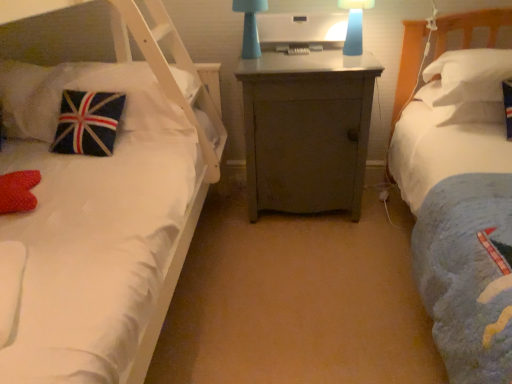
Question: From a real-world perspective, is white soft pillow at right, positioned as the first pillow in right-to-left order, physically above blue matte lampshade at upper center, which is counted as the first bedside lamp, starting from the right?

Choices:
 (A) yes
 (B) no

Answer: (B)

Question: Are white soft pillow at right, positioned as the first pillow in right-to-left order, and blue matte lampshade at upper center, which is counted as the first bedside lamp, starting from the right, making contact?

Choices:
 (A) no
 (B) yes

Answer: (A)

Question: Considering the relative sizes of white soft pillow at right, positioned as the first pillow in right-to-left order, and blue matte lampshade at upper center, which ranks as the second bedside lamp in left-to-right order, in the image provided, is white soft pillow at right, positioned as the first pillow in right-to-left order, thinner than blue matte lampshade at upper center, which ranks as the second bedside lamp in left-to-right order,?

Choices:
 (A) yes
 (B) no

Answer: (B)

Question: Is white soft pillow at right, the third pillow when ordered from left to right, facing towards blue matte lampshade at upper center, which ranks as the second bedside lamp in left-to-right order?

Choices:
 (A) no
 (B) yes

Answer: (A)

Question: Can you confirm if white soft pillow at right, positioned as the first pillow in right-to-left order, is smaller than blue matte lampshade at upper center, which is counted as the first bedside lamp, starting from the right?

Choices:
 (A) yes
 (B) no

Answer: (B)

Question: From a real-world perspective, is white soft pillow at right, which is counted as the second pillow, starting from the right, physically located above or below blue matte lampshade at upper center, which is counted as the first bedside lamp, starting from the right?

Choices:
 (A) above
 (B) below

Answer: (B)

Question: Is white soft pillow at right, placed as the second pillow when sorted from left to right, situated inside blue matte lampshade at upper center, which is counted as the first bedside lamp, starting from the right, or outside?

Choices:
 (A) outside
 (B) inside

Answer: (A)

Question: From the image's perspective, is white soft pillow at right, placed as the second pillow when sorted from left to right, positioned above or below blue matte lampshade at upper center, which ranks as the second bedside lamp in left-to-right order?

Choices:
 (A) above
 (B) below

Answer: (B)

Question: Based on their sizes in the image, would you say white soft pillow at right, placed as the second pillow when sorted from left to right, is bigger or smaller than blue matte lampshade at upper center, which is counted as the first bedside lamp, starting from the right?

Choices:
 (A) big
 (B) small

Answer: (A)

Question: Does point (354, 11) appear closer or farther from the camera than point (302, 203)?

Choices:
 (A) closer
 (B) farther

Answer: (A)

Question: Would you say blue matte lampshade at upper center, which ranks as the second bedside lamp in left-to-right order, is to the left or to the right of gray matte cabinet at center in the picture?

Choices:
 (A) left
 (B) right

Answer: (B)

Question: From the image's perspective, is blue matte lampshade at upper center, which is counted as the first bedside lamp, starting from the right, positioned above or below gray matte cabinet at center?

Choices:
 (A) above
 (B) below

Answer: (A)

Question: In terms of width, does blue matte lampshade at upper center, which ranks as the second bedside lamp in left-to-right order, look wider or thinner when compared to gray matte cabinet at center?

Choices:
 (A) wide
 (B) thin

Answer: (B)

Question: In terms of width, does gray matte cabinet at center look wider or thinner when compared to velvet union jack pillow at left, positioned as the 3th pillow in right-to-left order?

Choices:
 (A) wide
 (B) thin

Answer: (A)

Question: In terms of height, does gray matte cabinet at center look taller or shorter compared to velvet union jack pillow at left, which is counted as the 1th pillow, starting from the left?

Choices:
 (A) short
 (B) tall

Answer: (B)